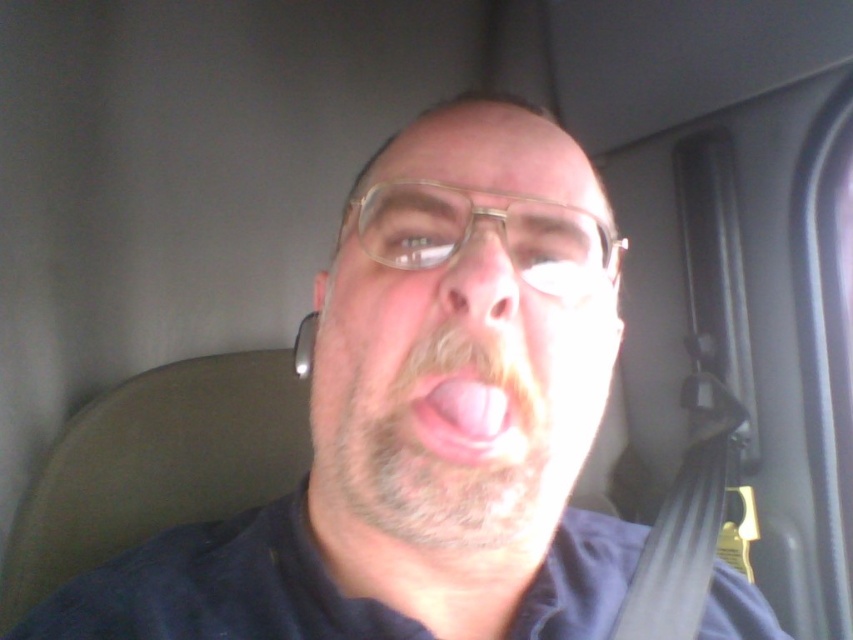
Based on the photo, who is more distant from viewer, (566, 355) or (480, 356)?

The point (566, 355) is behind.

Is smooth skin face at center to the left of pink flesh at center from the viewer's perspective?

Yes, smooth skin face at center is to the left of pink flesh at center.

Which is in front, point (428, 403) or point (451, 406)?

Point (451, 406) is more forward.

This screenshot has width=853, height=640. Identify the location of smooth skin face at center. (451, 396).